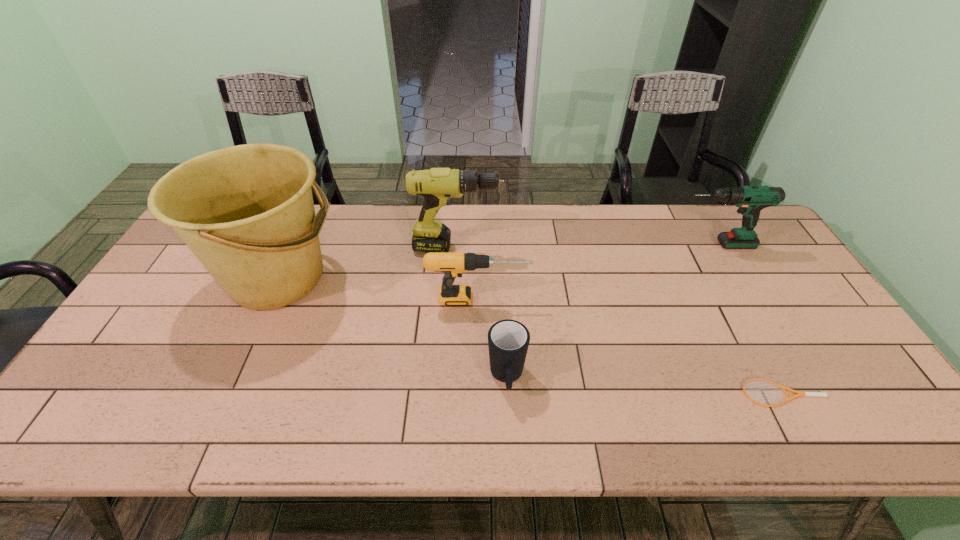
This screenshot has height=540, width=960. I want to click on object that is the fourth nearest to the nearest drill, so [x=751, y=200].

At what (x,y) coordinates should I click in order to perform the action: click on drill identified as the second closest to the fifth shortest object. Please return your answer as a coordinate pair (x, y). This screenshot has width=960, height=540. Looking at the image, I should click on (751, 200).

Locate an element on the screen. the second closest drill to the mug is located at coordinates (438, 186).

Identify the location of vacant area that satisfies the following two spatial constraints: 1. on the handle side of the shortest object; 2. on the right side of the shortest drill. (478, 393).

Identify the location of free space that satisfies the following two spatial constraints: 1. on the side of the shortest object with the handle; 2. on the right side of the mug. (508, 393).